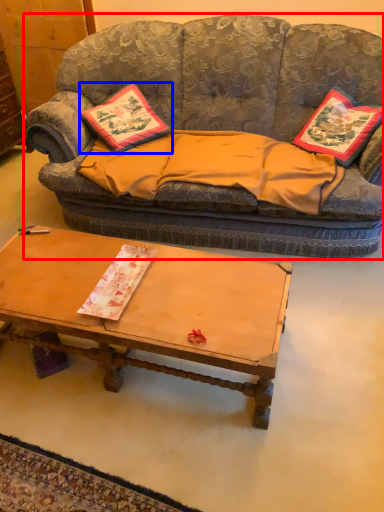
Question: Which object is further to the camera taking this photo, studio couch (highlighted by a red box) or pillow (highlighted by a blue box)?

Choices:
 (A) studio couch
 (B) pillow

Answer: (B)